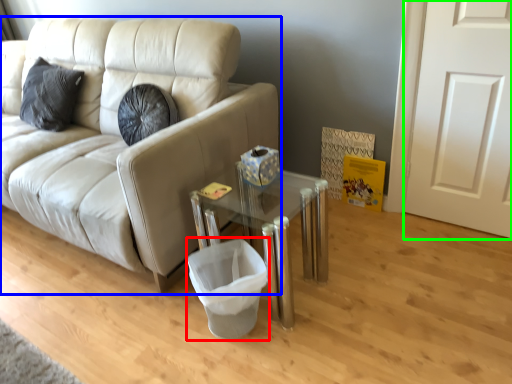
Question: Based on their relative distances, which object is nearer to laundry basket (highlighted by a red box)? Choose from studio couch (highlighted by a blue box) and door (highlighted by a green box).

Choices:
 (A) studio couch
 (B) door

Answer: (A)